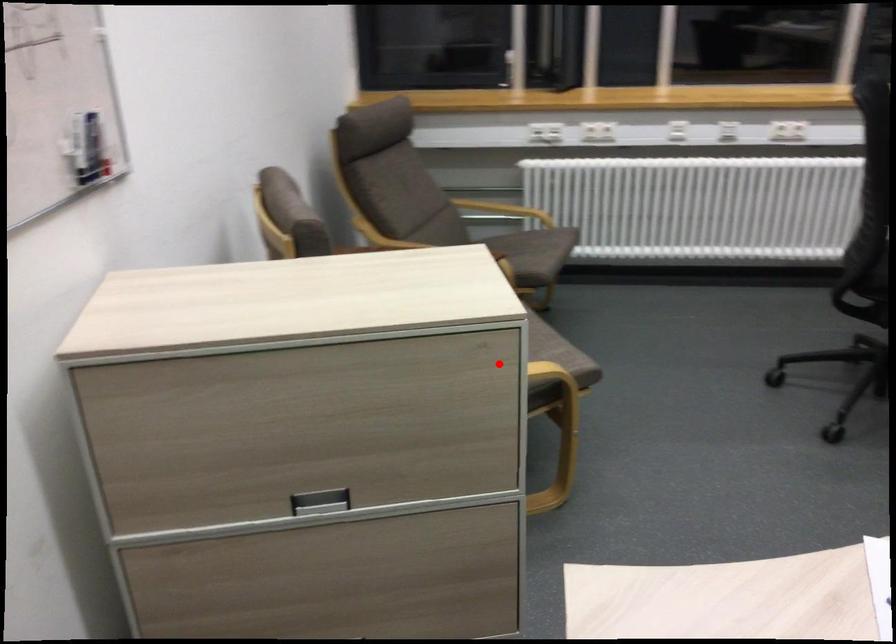
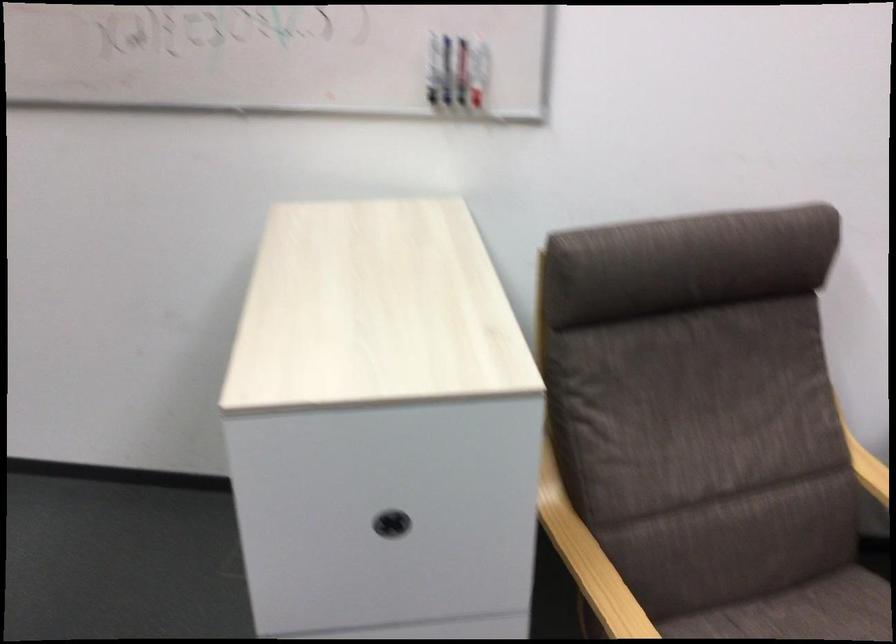
Find the pixel in the second image that matches the highlighted location in the first image.

(391, 524)